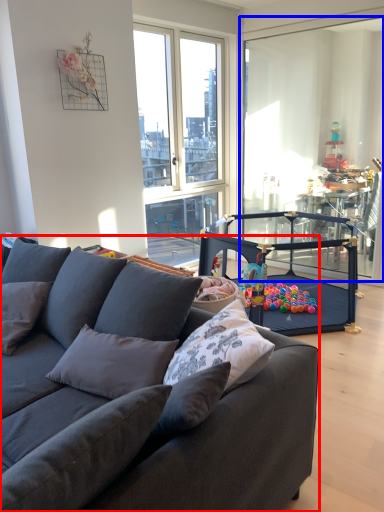
Question: Which of the following is the farthest to the observer, studio couch (highlighted by a red box) or screen door (highlighted by a blue box)?

Choices:
 (A) studio couch
 (B) screen door

Answer: (B)